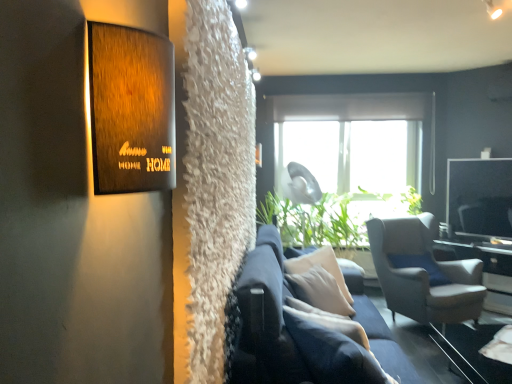
Question: Is navy blue fabric couch at center at the left side of matte gray fabric armchair at right?

Choices:
 (A) yes
 (B) no

Answer: (A)

Question: Could you tell me if navy blue fabric couch at center is turned towards matte gray fabric armchair at right?

Choices:
 (A) yes
 (B) no

Answer: (B)

Question: Is navy blue fabric couch at center further to the viewer compared to matte gray fabric armchair at right?

Choices:
 (A) no
 (B) yes

Answer: (A)

Question: Is navy blue fabric couch at center wider than matte gray fabric armchair at right?

Choices:
 (A) yes
 (B) no

Answer: (B)

Question: Is navy blue fabric couch at center to the right of matte gray fabric armchair at right from the viewer's perspective?

Choices:
 (A) yes
 (B) no

Answer: (B)

Question: Is navy blue fabric couch at center positioned before matte gray fabric armchair at right?

Choices:
 (A) yes
 (B) no

Answer: (A)

Question: Is matte gray fabric armchair at right positioned far away from navy blue fabric couch at center?

Choices:
 (A) yes
 (B) no

Answer: (A)

Question: From the image's perspective, is matte gray fabric armchair at right located above navy blue fabric couch at center?

Choices:
 (A) yes
 (B) no

Answer: (A)

Question: Is matte gray fabric armchair at right at the left side of navy blue fabric couch at center?

Choices:
 (A) no
 (B) yes

Answer: (A)

Question: Is matte gray fabric armchair at right positioned before navy blue fabric couch at center?

Choices:
 (A) yes
 (B) no

Answer: (B)

Question: Does matte gray fabric armchair at right have a greater width compared to navy blue fabric couch at center?

Choices:
 (A) yes
 (B) no

Answer: (A)

Question: Does matte gray fabric armchair at right have a smaller size compared to navy blue fabric couch at center?

Choices:
 (A) no
 (B) yes

Answer: (A)

Question: Does matte gray fabric armchair at right have a smaller size compared to white glossy table at right?

Choices:
 (A) no
 (B) yes

Answer: (A)